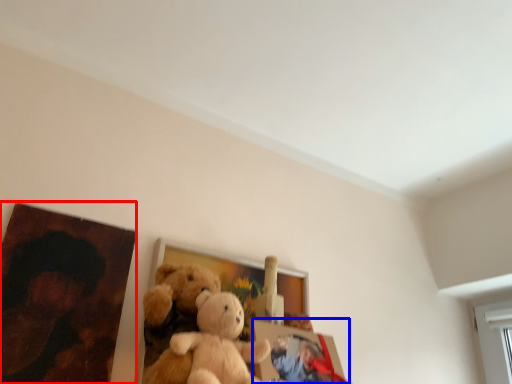
Question: Which object appears farthest to the camera in this image, picture frame (highlighted by a red box) or picture frame (highlighted by a blue box)?

Choices:
 (A) picture frame
 (B) picture frame

Answer: (B)